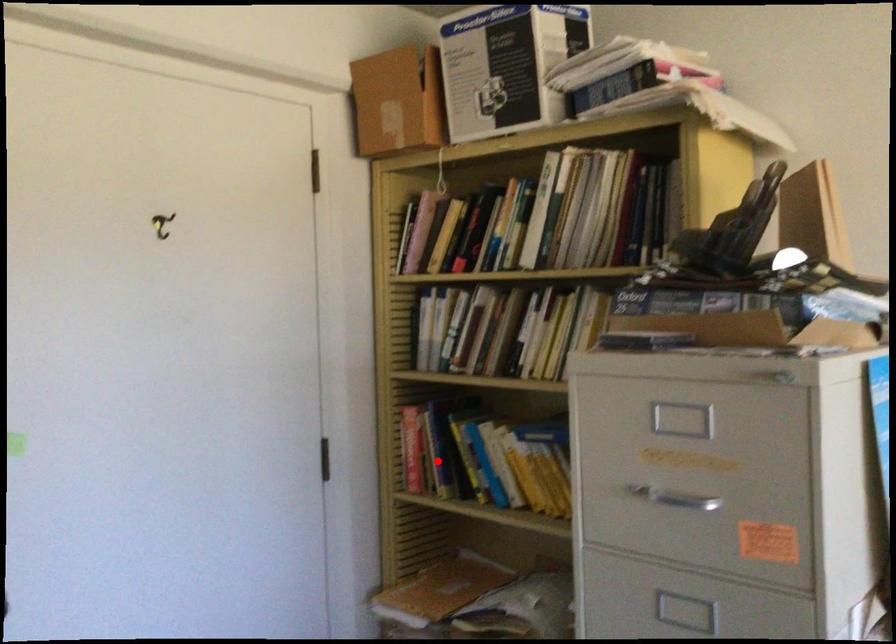
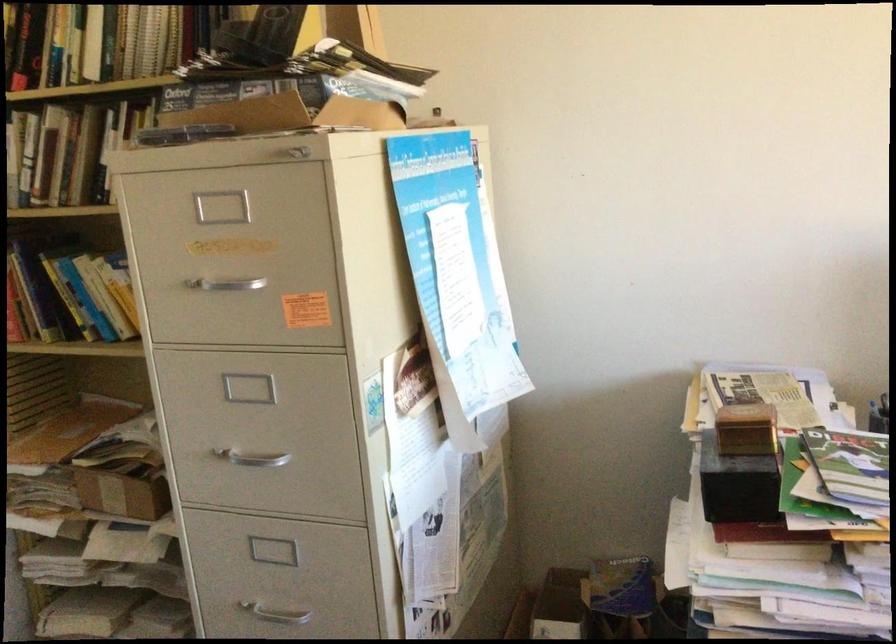
Where in the second image is the point corresponding to the highlighted location from the first image?

(27, 301)